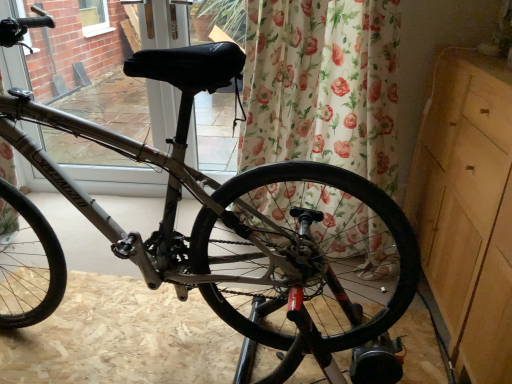
Question: In the image, is light wood dresser at right positioned in front of or behind black leather seat at upper center?

Choices:
 (A) front
 (B) behind

Answer: (A)

Question: From a real-world perspective, is light wood dresser at right positioned above or below black leather seat at upper center?

Choices:
 (A) below
 (B) above

Answer: (A)

Question: Estimate the real-world distances between objects in this image. Which object is closer to the black leather seat at upper center?

Choices:
 (A) black rubber tire at center
 (B) floral fabric curtain at center
 (C) light wood dresser at right

Answer: (B)

Question: Which is nearer to the black leather seat at upper center?

Choices:
 (A) light wood dresser at right
 (B) floral fabric curtain at center
 (C) black rubber tire at center

Answer: (B)